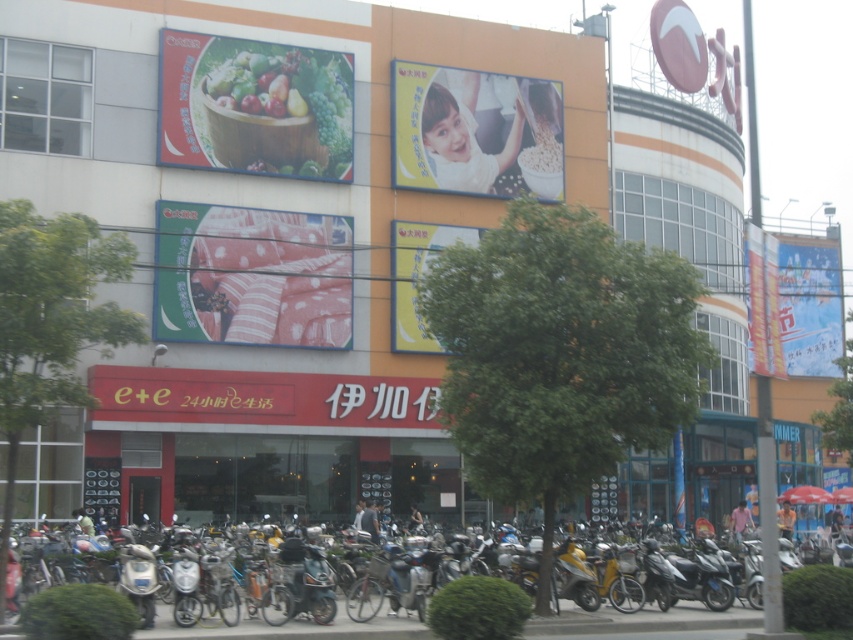
You are a customer in a clothing store looking at two fabrics displayed on a table. The polka dot fabric at center and the dark gray fabric shirt at center are both on the table. Which fabric is located to the left?

The polka dot fabric at center is positioned on the left side of dark gray fabric shirt at center, so the polka dot fabric at center is located to the left.